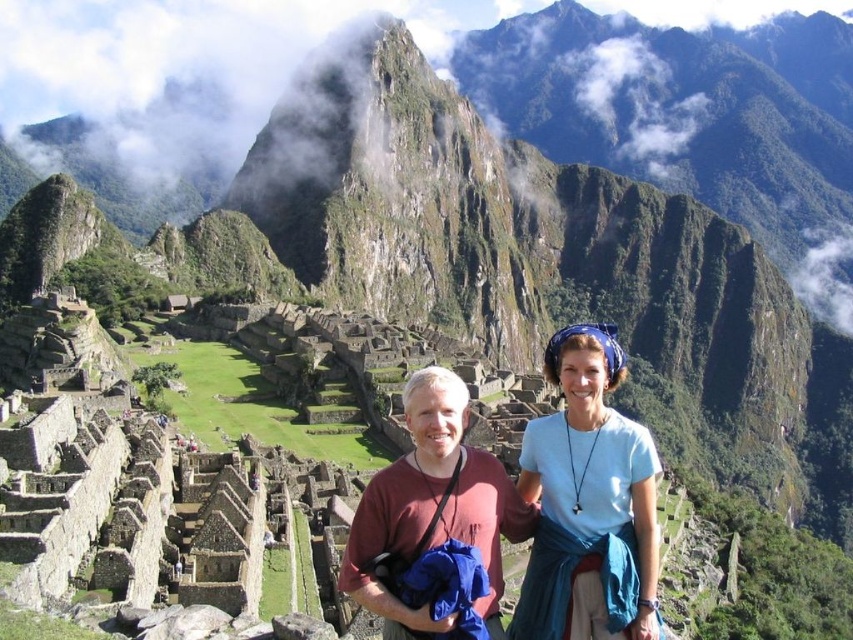
Which is below, matte red shirt at center or blue fabric headscarf at upper right?

blue fabric headscarf at upper right is below.

In the scene shown: Is matte red shirt at center above blue fabric headscarf at upper right?

Correct, matte red shirt at center is located above blue fabric headscarf at upper right.

Does point (605, 536) come farther from viewer compared to point (540, 573)?

No, it is in front of (540, 573).

I want to click on matte red shirt at center, so (585, 502).